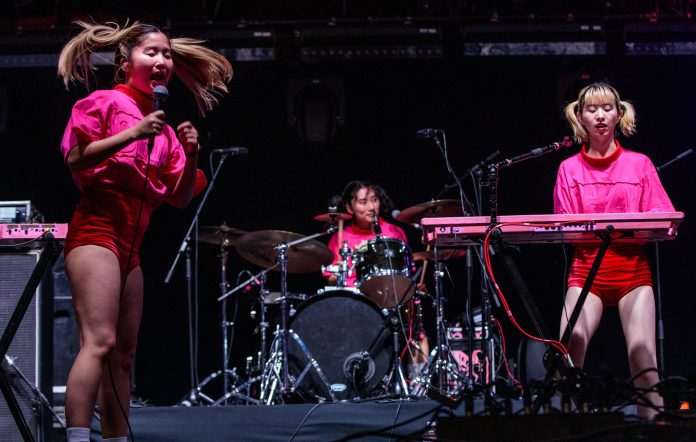
This screenshot has height=442, width=696. Identify the location of stage. (294, 419).